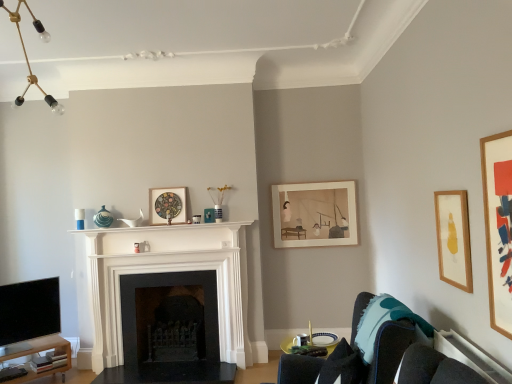
This screenshot has height=384, width=512. What are the coordinates of `empty space that is ontop of wooden picture frame at center, the 4th picture frame from the right (from a real-world perspective)` in the screenshot? It's located at (166, 189).